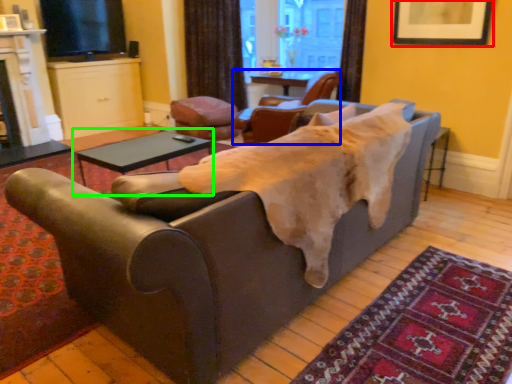
Question: Which object is positioned farthest from picture frame (highlighted by a red box)? Select from chair (highlighted by a blue box) and table (highlighted by a green box).

Choices:
 (A) chair
 (B) table

Answer: (B)